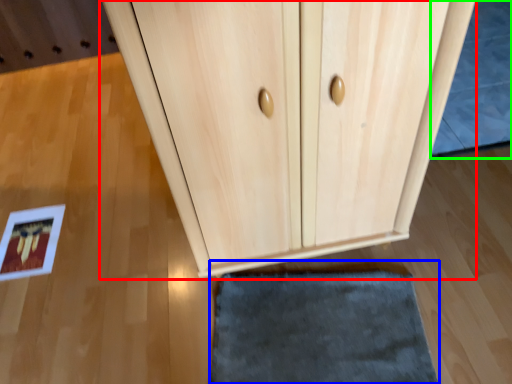
Question: Which is nearer to the cupboard (highlighted by a red box)? door (highlighted by a blue box) or bath mat (highlighted by a green box).

Choices:
 (A) door
 (B) bath mat

Answer: (A)